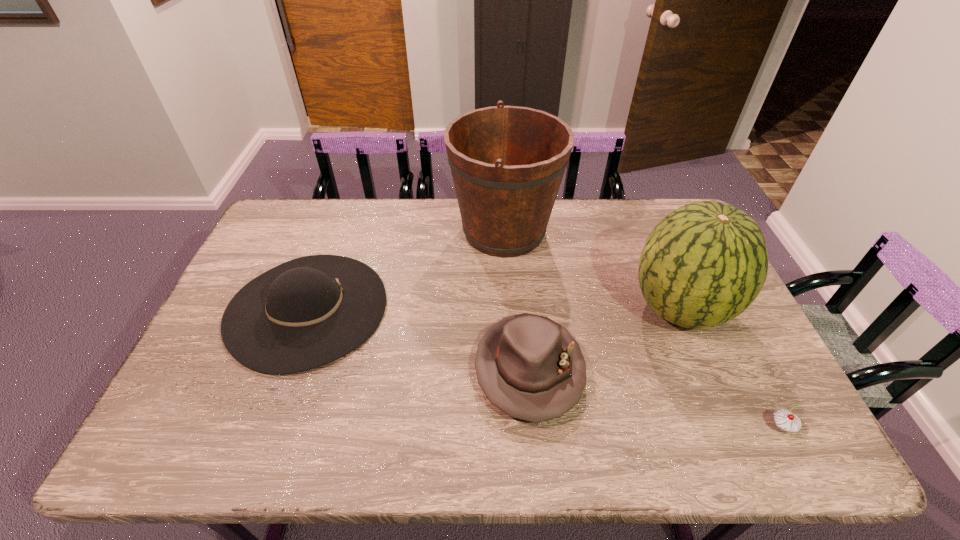
Identify the location of bucket. (507, 162).

At what (x,y) coordinates should I click in order to perform the action: click on watermelon. Please return your answer as a coordinate pair (x, y). Image resolution: width=960 pixels, height=540 pixels. Looking at the image, I should click on (703, 264).

Identify the location of the leftmost object. (307, 312).

The image size is (960, 540). In order to click on hat in this screenshot , I will do `click(530, 367)`.

This screenshot has width=960, height=540. I want to click on the shortest object, so click(785, 421).

Find the location of a particular element. This screenshot has height=540, width=960. free region located 0.050m on the right of the bucket is located at coordinates (573, 231).

At what (x,y) coordinates should I click in order to perform the action: click on vacant space located 0.170m on the left of the watermelon. Please return your answer as a coordinate pair (x, y). This screenshot has height=540, width=960. Looking at the image, I should click on (570, 308).

Locate an element on the screen. This screenshot has width=960, height=540. vacant space located on the front-facing side of the sombrero is located at coordinates (475, 308).

The height and width of the screenshot is (540, 960). I want to click on free location located on the left of the cupcake, so click(x=637, y=427).

Identify the location of object present at the far edge. (507, 162).